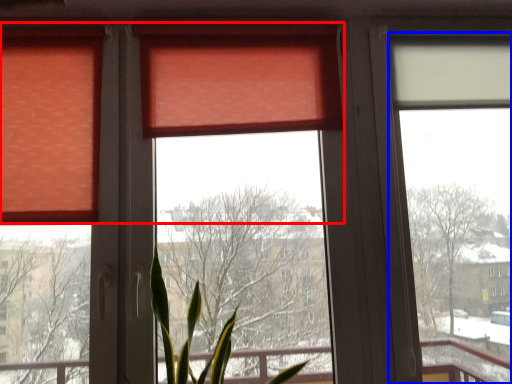
Question: Which of the following is the closest to the observer, curtain (highlighted by a red box) or window screen (highlighted by a blue box)?

Choices:
 (A) curtain
 (B) window screen

Answer: (A)